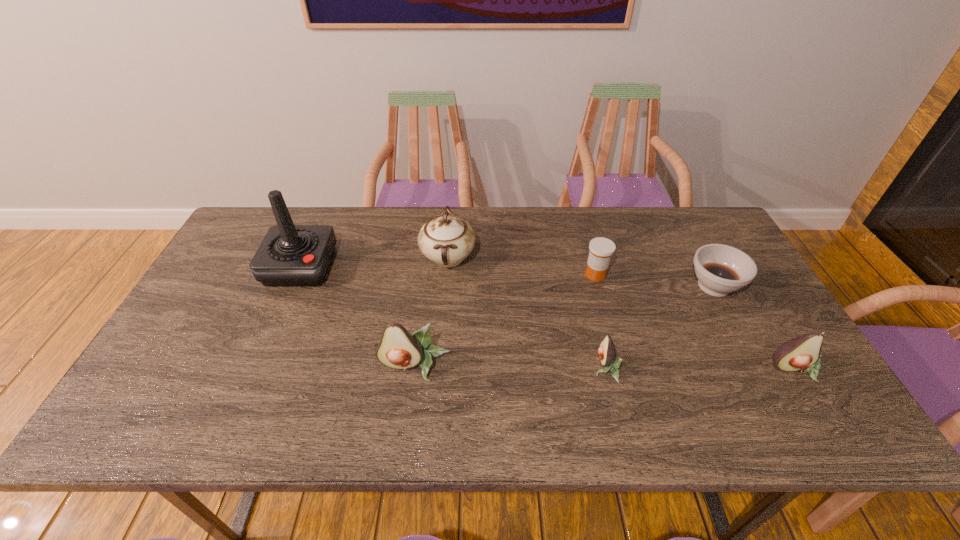
At what (x,y) coordinates should I click in order to perform the action: click on vacant space that satisfies the following two spatial constraints: 1. on the front-facing side of the joystick; 2. on the right side of the soup bowl. Please return your answer as a coordinate pair (x, y). Image resolution: width=960 pixels, height=540 pixels. Looking at the image, I should click on (292, 286).